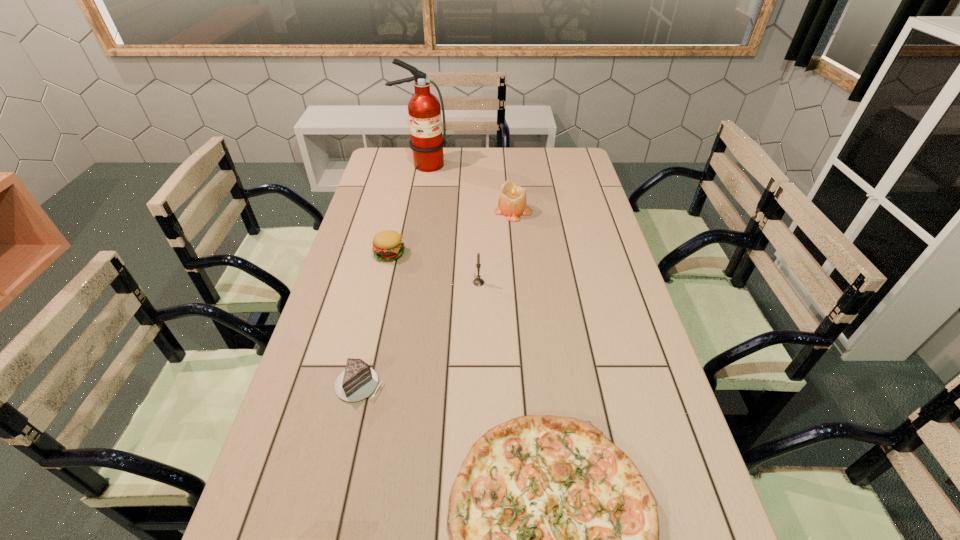
Image resolution: width=960 pixels, height=540 pixels. In order to click on vacant position at the left edge of the desktop in this screenshot , I will do `click(272, 500)`.

The height and width of the screenshot is (540, 960). What are the coordinates of `vacant space at the right edge of the desktop` in the screenshot? It's located at (564, 196).

In the image, there is a desktop. Where is `free region at the far left corner`? The height and width of the screenshot is (540, 960). free region at the far left corner is located at coordinates (381, 169).

I want to click on vacant region at the far right corner, so click(549, 149).

I want to click on empty space that is in between the farther candle and the left candle, so click(496, 247).

This screenshot has width=960, height=540. I want to click on vacant area that lies between the left candle and the farther candle, so click(496, 247).

Locate an element on the screen. free space between the fire extinguisher and the farther candle is located at coordinates (468, 188).

At what (x,y) coordinates should I click in order to perform the action: click on free spot between the third farthest object and the fire extinguisher. Please return your answer as a coordinate pair (x, y). Image resolution: width=960 pixels, height=540 pixels. Looking at the image, I should click on (406, 209).

The width and height of the screenshot is (960, 540). Identify the location of vacant region between the right candle and the fifth farthest object. (437, 299).

Locate which object is the closest to the third farthest object. Please provide its 2D coordinates. Your answer should be formatted as a tuple, i.e. [(x, y)], where the tuple contains the x and y coordinates of a point satisfying the conditions above.

[(478, 281)]